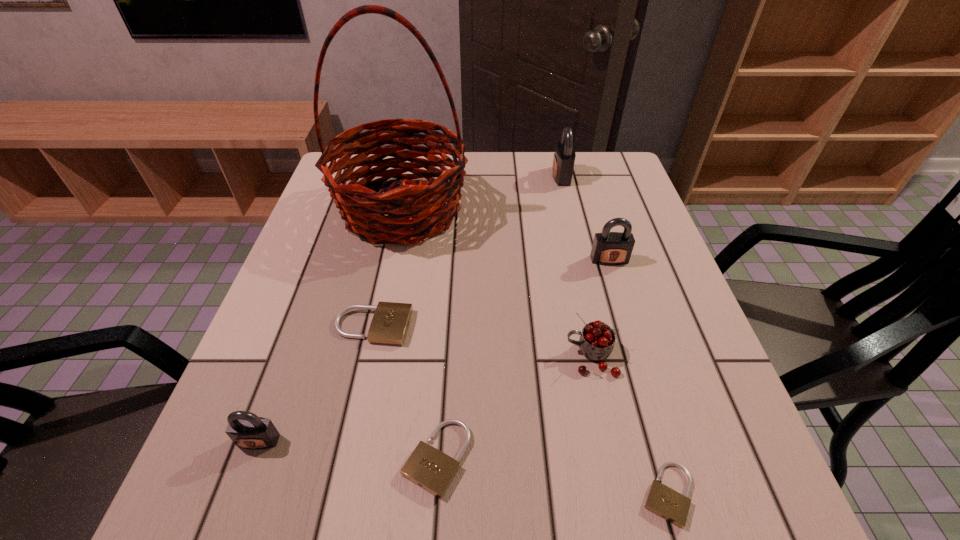
This screenshot has width=960, height=540. What are the coordinates of `free point between the leftmost gray padlock and the red cherry` in the screenshot? It's located at (424, 399).

This screenshot has height=540, width=960. I want to click on free area in between the fourth padlock from right to left and the sixth shortest object, so click(523, 359).

What are the coordinates of `vacant space that is in between the farthest beige padlock and the third padlock from left to right` in the screenshot? It's located at (405, 392).

The image size is (960, 540). What are the coordinates of `empty space between the second shortest padlock and the biggest beige padlock` in the screenshot? It's located at (405, 392).

In order to click on the fourth closest object to the shortest object in this screenshot , I will do 609,248.

Find the location of `the sixth closest object relative to the second biggest beige padlock`. the sixth closest object relative to the second biggest beige padlock is located at coordinates (609, 248).

Choose which padlock is the third nearest neighbor to the second beige padlock from right to left. Please provide its 2D coordinates. Your answer should be formatted as a tuple, i.e. [(x, y)], where the tuple contains the x and y coordinates of a point satisfying the conditions above.

[(669, 504)]

Locate which padlock ranks fifth in proximity to the cherry. Please provide its 2D coordinates. Your answer should be formatted as a tuple, i.e. [(x, y)], where the tuple contains the x and y coordinates of a point satisfying the conditions above.

[(247, 430)]

Select which gray padlock appears as the second closest to the leftmost padlock. Please provide its 2D coordinates. Your answer should be formatted as a tuple, i.e. [(x, y)], where the tuple contains the x and y coordinates of a point satisfying the conditions above.

[(564, 157)]

Locate an element on the screen. gray padlock object that ranks as the third closest to the biggest beige padlock is located at coordinates (564, 157).